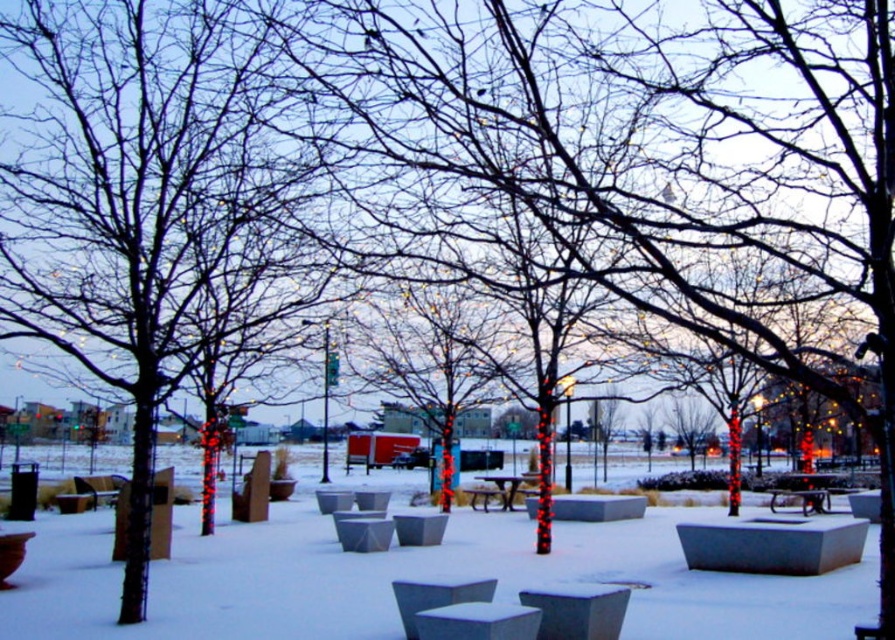
You are a delivery person with a cart that is 5 meters long. You need to move from the white matte snow at center to the metallic silver picnic table at center. Can your cart fit through the space between them?

The distance between the white matte snow at center and the metallic silver picnic table at center is 4.90 meters. Since your cart is 5 meters long, it cannot fit through the space between them as the distance is slightly shorter than the cart.

Based on the scene description, what is located at the coordinates point (407,577)?

The white matte snow at center is located at point (407,577).

You are standing in the winter park scene and want to place a small ornament on the closest object to you. Which object should you choose between the white matte snow at center and the metallic silver picnic table at center?

The white matte snow at center is closer to the viewer than the metallic silver picnic table at center, so you should place the ornament on the white matte snow at center.